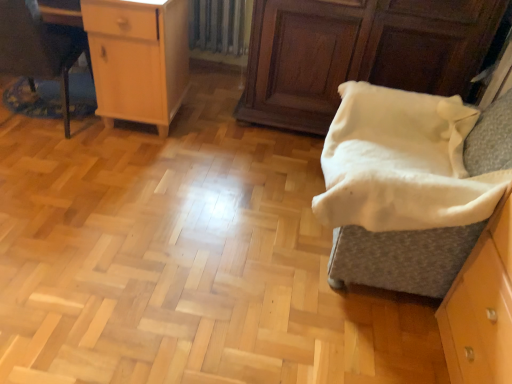
At what (x,y) coordinates should I click in order to perform the action: click on vacant space to the right of light wood cabinet at upper left. Please return your answer as a coordinate pair (x, y). Looking at the image, I should click on (210, 144).